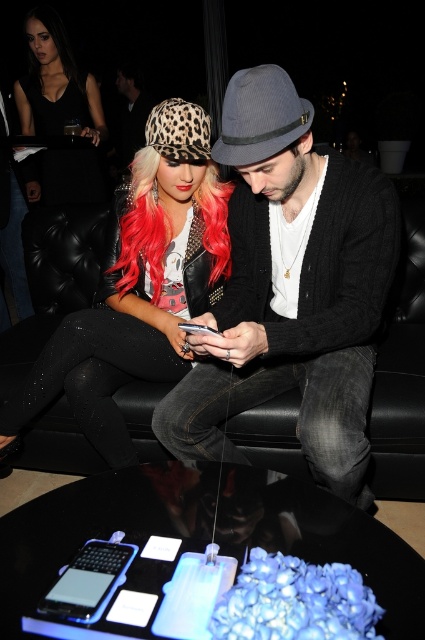
Question: Which of these objects is positioned closest to the pinkhair at center?

Choices:
 (A) leopard print hat at center
 (B) leather jacket at center
 (C) matte black dress at upper left
 (D) matte gray fedora at center

Answer: (A)

Question: Considering the real-world distances, which object is farthest from the leather jacket at center?

Choices:
 (A) matte gray fedora at center
 (B) leopard print hat at center
 (C) pinkhair at center
 (D) matte black dress at upper left

Answer: (A)

Question: Observing the image, what is the correct spatial positioning of leopard print hat at center in reference to matte black dress at upper left?

Choices:
 (A) left
 (B) right

Answer: (B)

Question: Can you confirm if matte gray fedora at center is thinner than matte black dress at upper left?

Choices:
 (A) yes
 (B) no

Answer: (B)

Question: Is pinkhair at center closer to camera compared to leather jacket at center?

Choices:
 (A) no
 (B) yes

Answer: (B)

Question: Which object is positioned farthest from the leopard print hat at center?

Choices:
 (A) pinkhair at center
 (B) matte gray fedora at center
 (C) matte black dress at upper left

Answer: (C)